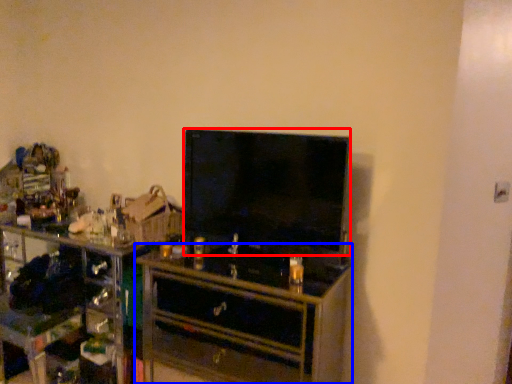
Question: Among these objects, which one is nearest to the camera, television (highlighted by a red box) or chest of drawers (highlighted by a blue box)?

Choices:
 (A) television
 (B) chest of drawers

Answer: (B)